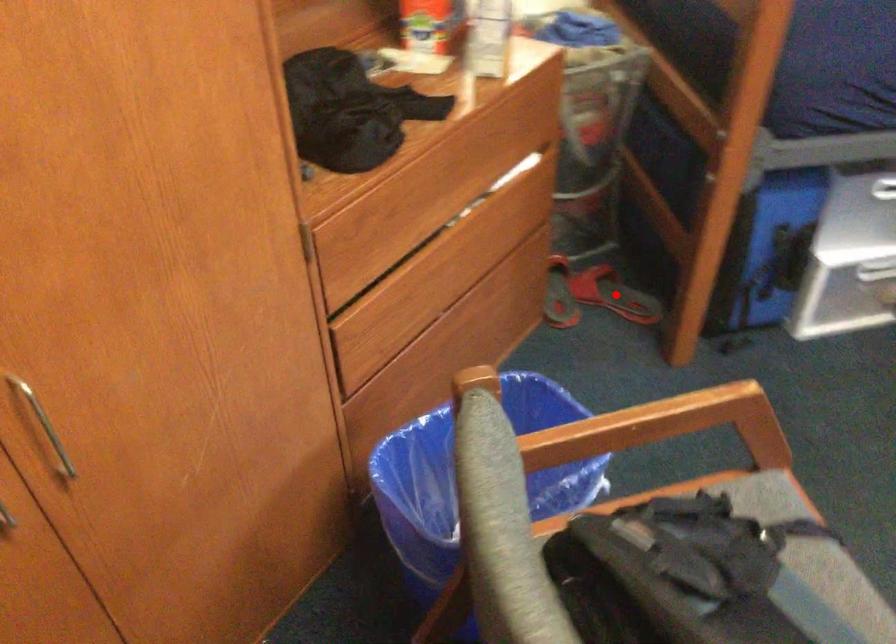
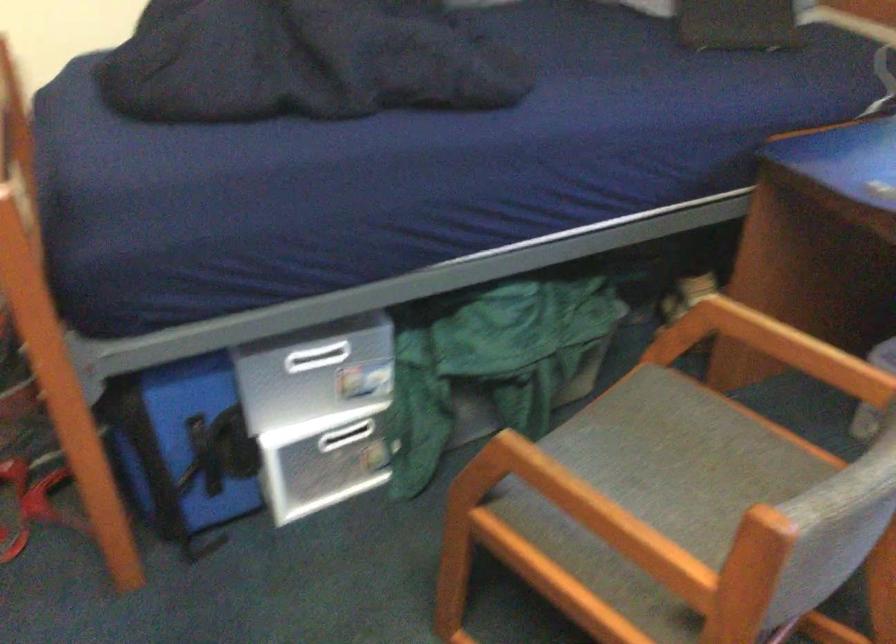
Question: I am providing you with two images of the same scene from different viewpoints. A red point is marked on the first image. Can you still see the location of the red point in image 2?

Choices:
 (A) Yes
 (B) No

Answer: (B)